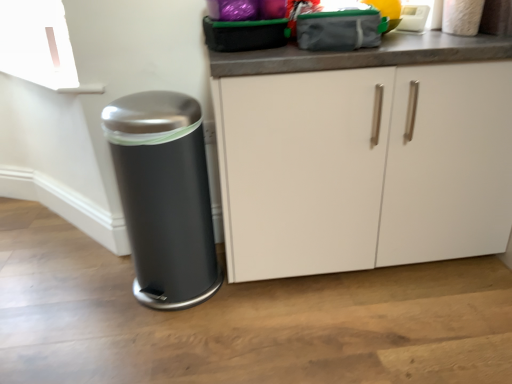
Question: From a real-world perspective, is white matte cabinet at center below white plastic appliance at upper right?

Choices:
 (A) yes
 (B) no

Answer: (A)

Question: Does white matte cabinet at center have a smaller size compared to white plastic appliance at upper right?

Choices:
 (A) no
 (B) yes

Answer: (A)

Question: Does white matte cabinet at center appear on the right side of white plastic appliance at upper right?

Choices:
 (A) yes
 (B) no

Answer: (B)

Question: Is white plastic appliance at upper right a part of white matte cabinet at center?

Choices:
 (A) yes
 (B) no

Answer: (B)

Question: Considering the relative sizes of white matte cabinet at center and white plastic appliance at upper right in the image provided, is white matte cabinet at center taller than white plastic appliance at upper right?

Choices:
 (A) yes
 (B) no

Answer: (A)

Question: Are white matte cabinet at center and white plastic appliance at upper right far apart?

Choices:
 (A) no
 (B) yes

Answer: (A)

Question: From the image's perspective, would you say satin black trash can at lower left is shown under white plastic appliance at upper right?

Choices:
 (A) yes
 (B) no

Answer: (A)

Question: Are satin black trash can at lower left and white plastic appliance at upper right far apart?

Choices:
 (A) no
 (B) yes

Answer: (A)

Question: Is satin black trash can at lower left at the left side of white plastic appliance at upper right?

Choices:
 (A) no
 (B) yes

Answer: (B)

Question: Is satin black trash can at lower left turned away from white plastic appliance at upper right?

Choices:
 (A) yes
 (B) no

Answer: (B)

Question: From the image's perspective, is satin black trash can at lower left above white plastic appliance at upper right?

Choices:
 (A) no
 (B) yes

Answer: (A)

Question: Is satin black trash can at lower left closer to camera compared to white plastic appliance at upper right?

Choices:
 (A) no
 (B) yes

Answer: (B)

Question: Can you confirm if satin black trash can at lower left is positioned to the left of white matte cabinet at center?

Choices:
 (A) no
 (B) yes

Answer: (B)